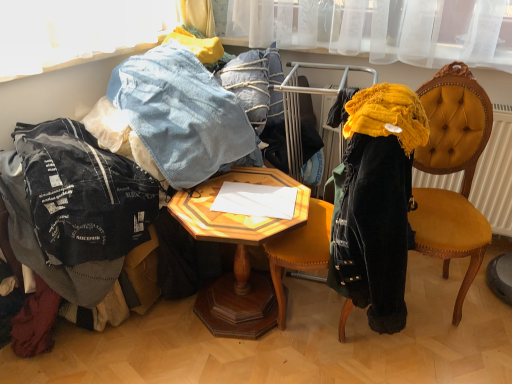
This screenshot has width=512, height=384. In order to click on vacant space underneath velvet yellow chair at right (from a real-world perspective) in this screenshot , I will do `click(429, 297)`.